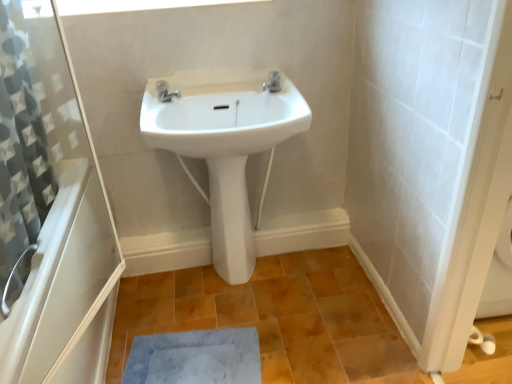
Find the location of a particular element. This screenshot has width=512, height=384. white glossy bath at lower left is located at coordinates (65, 288).

Describe the element at coordinates (65, 288) in the screenshot. This screenshot has height=384, width=512. I see `white glossy bath at lower left` at that location.

Describe the element at coordinates (133, 5) in the screenshot. I see `transparent plastic window screen at upper center` at that location.

What is the approximate height of blue fuzzy mat at lower center?

It is 4.97 centimeters.

What do you see at coordinates (273, 82) in the screenshot? I see `satin nickel faucet at center, the second tap when ordered from left to right` at bounding box center [273, 82].

Locate an element on the screen. This screenshot has height=384, width=512. white glossy bath at lower left is located at coordinates (65, 288).

Is white glossy bath at lower left completely or partially outside of gray textured shower curtain at left?

Yes.

Which is more to the left, white glossy bath at lower left or gray textured shower curtain at left?

white glossy bath at lower left.

From the image's perspective, which object appears higher, white glossy bath at lower left or gray textured shower curtain at left?

From the image's view, gray textured shower curtain at left is above.

Where is `shower curtain above the white glossy bath at lower left (from a real-world perspective)`? This screenshot has height=384, width=512. shower curtain above the white glossy bath at lower left (from a real-world perspective) is located at coordinates (20, 156).

Is orange matte tile at center in front of white glossy bath at lower left?

No, orange matte tile at center is further to the viewer.

From the image's perspective, is orange matte tile at center above or below white glossy bath at lower left?

From the image's perspective, orange matte tile at center appears below white glossy bath at lower left.

Identify the location of ceramic tile located behind the white glossy bath at lower left. (276, 318).

Is orange matte tile at center at the left side of white glossy bath at lower left?

Incorrect, orange matte tile at center is not on the left side of white glossy bath at lower left.

From a real-world perspective, is transparent plastic window screen at upper center below satin nickel faucet at center, which is counted as the first tap, starting from the right?

No, from a real-world perspective, transparent plastic window screen at upper center is not under satin nickel faucet at center, which is counted as the first tap, starting from the right.

Is transparent plastic window screen at upper center not close to satin nickel faucet at center, the second tap when ordered from left to right?

transparent plastic window screen at upper center is near satin nickel faucet at center, the second tap when ordered from left to right, not far away.

Is transparent plastic window screen at upper center looking in the opposite direction of satin nickel faucet at center, which is counted as the first tap, starting from the right?

transparent plastic window screen at upper center is not turned away from satin nickel faucet at center, which is counted as the first tap, starting from the right.

Considering the relative positions of transparent plastic window screen at upper center and satin nickel faucet at center, which is counted as the first tap, starting from the right, in the image provided, is transparent plastic window screen at upper center to the left of satin nickel faucet at center, which is counted as the first tap, starting from the right, from the viewer's perspective?

Yes, transparent plastic window screen at upper center is to the left of satin nickel faucet at center, which is counted as the first tap, starting from the right.

Is satin nickel faucet at center, the second tap when ordered from left to right, facing away from orange matte tile at center?

No, orange matte tile at center is not at the back of satin nickel faucet at center, the second tap when ordered from left to right.

Can you confirm if satin nickel faucet at center, the second tap when ordered from left to right, is thinner than orange matte tile at center?

Correct, the width of satin nickel faucet at center, the second tap when ordered from left to right, is less than that of orange matte tile at center.

Is point (267, 82) farther from camera compared to point (197, 269)?

That is False.

Considering the positions of objects satin nickel faucet at center, the second tap when ordered from left to right, and orange matte tile at center in the image provided, who is more to the left, satin nickel faucet at center, the second tap when ordered from left to right, or orange matte tile at center?

orange matte tile at center is more to the left.

In the scene shown: Looking at their sizes, would you say white ceramic sink at center is wider or thinner than orange matte tile at center?

Clearly, white ceramic sink at center has less width compared to orange matte tile at center.

Between white ceramic sink at center and orange matte tile at center, which one has more height?

With more height is white ceramic sink at center.

Who is bigger, white ceramic sink at center or orange matte tile at center?

Bigger between the two is orange matte tile at center.

How far apart are white ceramic sink at center and transparent plastic window screen at upper center?

white ceramic sink at center is 15.43 inches from transparent plastic window screen at upper center.

Who is taller, white ceramic sink at center or transparent plastic window screen at upper center?

Standing taller between the two is white ceramic sink at center.

How many degrees apart are the facing directions of white ceramic sink at center and transparent plastic window screen at upper center?

white ceramic sink at center and transparent plastic window screen at upper center are facing 0.193 degrees away from each other.

Could transparent plastic window screen at upper center be considered to be inside white ceramic sink at center?

No, transparent plastic window screen at upper center is not a part of white ceramic sink at center.

Could you tell me if blue fuzzy mat at lower center is facing orange matte tile at center?

Yes, blue fuzzy mat at lower center faces towards orange matte tile at center.

Is blue fuzzy mat at lower center beside orange matte tile at center?

No.

Is blue fuzzy mat at lower center wider or thinner than orange matte tile at center?

Clearly, blue fuzzy mat at lower center has less width compared to orange matte tile at center.

Between blue fuzzy mat at lower center and orange matte tile at center, which one has less height?

With less height is blue fuzzy mat at lower center.

Locate an element on the screen. The image size is (512, 384). bath below the gray textured shower curtain at left (from a real-world perspective) is located at coordinates (65, 288).

The width and height of the screenshot is (512, 384). I want to click on bath positioned vertically above the orange matte tile at center (from a real-world perspective), so click(65, 288).

When comparing their distances from white glossy bath at lower left, does polished chrome tap at upper center, the second tap positioned from the right, or white glossy bidet at center seem closer?

white glossy bidet at center lies closer to white glossy bath at lower left than the other object.

Based on their spatial positions, is orange matte tile at center or transparent plastic window screen at upper center further from gray textured shower curtain at left?

orange matte tile at center is further to gray textured shower curtain at left.

Looking at the image, which one is located closer to white glossy bidet at center, gray textured shower curtain at left or polished chrome tap at upper center, the 1th tap in the left-to-right sequence?

polished chrome tap at upper center, the 1th tap in the left-to-right sequence, is closer to white glossy bidet at center.

From the image, which object appears to be nearer to orange matte tile at center, white glossy bidet at center or blue fuzzy mat at lower center?

blue fuzzy mat at lower center is positioned closer to the anchor orange matte tile at center.

Which object lies nearer to the anchor point satin nickel faucet at center, which is counted as the first tap, starting from the right, white glossy bidet at center or gray textured shower curtain at left?

The object closer to satin nickel faucet at center, which is counted as the first tap, starting from the right, is white glossy bidet at center.

Considering their positions, is white ceramic sink at center positioned closer to white glossy bath at lower left than transparent plastic window screen at upper center?

Based on the image, white ceramic sink at center appears to be nearer to white glossy bath at lower left.

Considering their positions, is orange matte tile at center positioned further to transparent plastic window screen at upper center than white ceramic sink at center?

Among the two, orange matte tile at center is located further to transparent plastic window screen at upper center.

Which object lies nearer to the anchor point white glossy bath at lower left, polished chrome tap at upper center, the 1th tap in the left-to-right sequence, or satin nickel faucet at center, which is counted as the first tap, starting from the right?

polished chrome tap at upper center, the 1th tap in the left-to-right sequence.

The height and width of the screenshot is (384, 512). I want to click on bidet between satin nickel faucet at center, which is counted as the first tap, starting from the right, and blue fuzzy mat at lower center vertically, so click(x=231, y=219).

Identify the location of sink between white glossy bath at lower left and orange matte tile at center in the horizontal direction. The height and width of the screenshot is (384, 512). (222, 114).

You are a GUI agent. You are given a task and a screenshot of the screen. Output one action in this format:
    pyautogui.click(x=<x>, y=<y>)
    Task: Click on the sink positioned between gray textured shower curtain at left and polished chrome tap at upper center, the second tap positioned from the right, from near to far
    
    Given the screenshot: What is the action you would take?
    pyautogui.click(x=222, y=114)

The image size is (512, 384). I want to click on sink between gray textured shower curtain at left and transparent plastic window screen at upper center along the z-axis, so click(x=222, y=114).